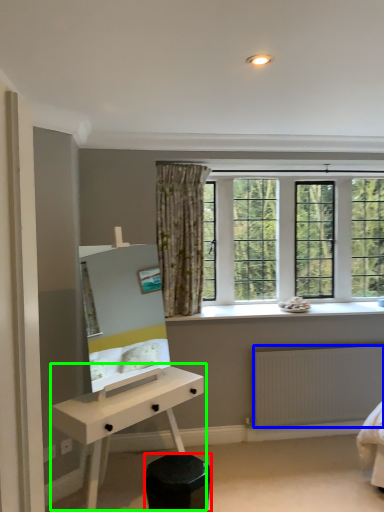
Question: Considering the real-world distances, which object is closest to stool (highlighted by a red box)? radiator (highlighted by a blue box) or desk (highlighted by a green box).

Choices:
 (A) radiator
 (B) desk

Answer: (B)